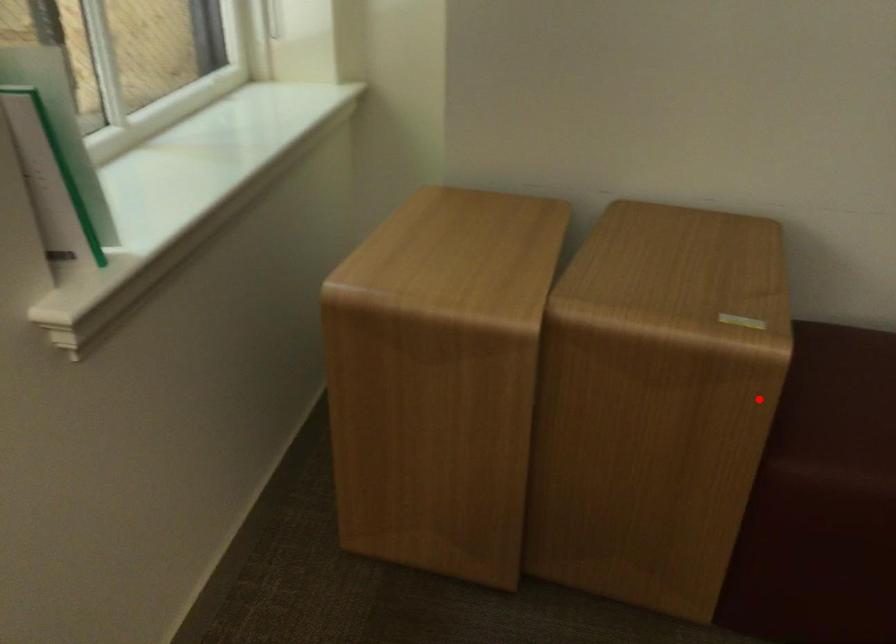
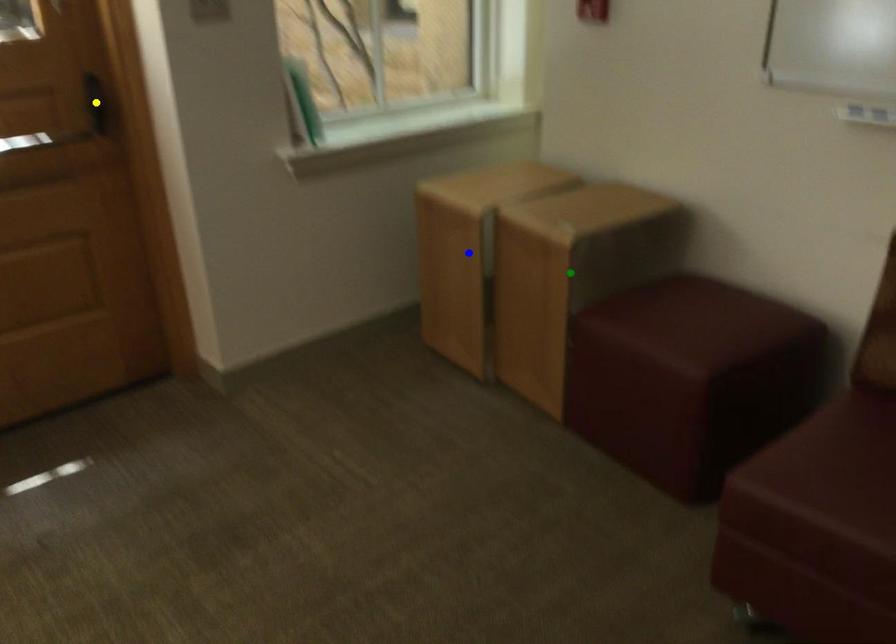
Question: I am providing you with two images of the same scene from different viewpoints. A red point is marked on the first image. You are given multiple points on the second image. Which mark in image 2 goes with the point in image 1?

Choices:
 (A) blue point
 (B) green point
 (C) yellow point

Answer: (B)